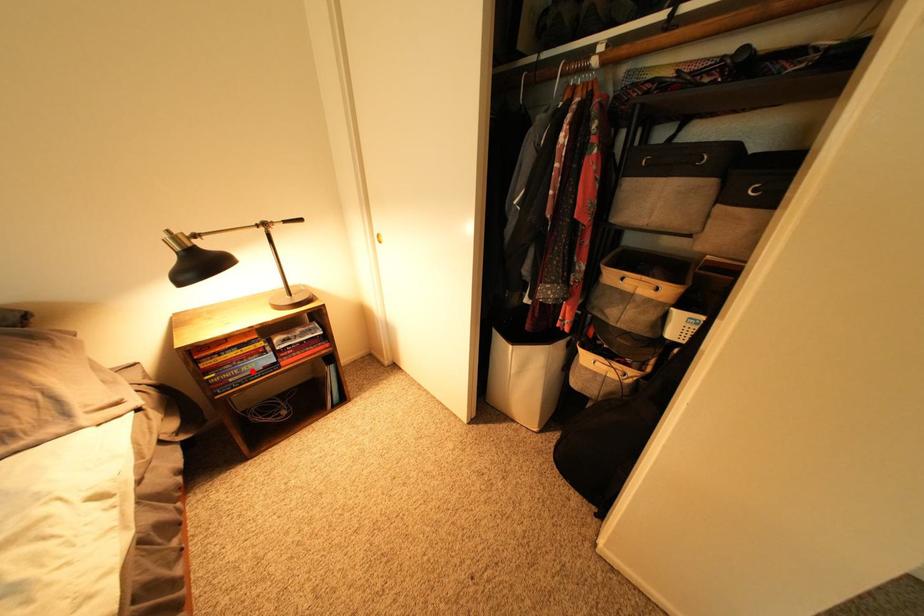
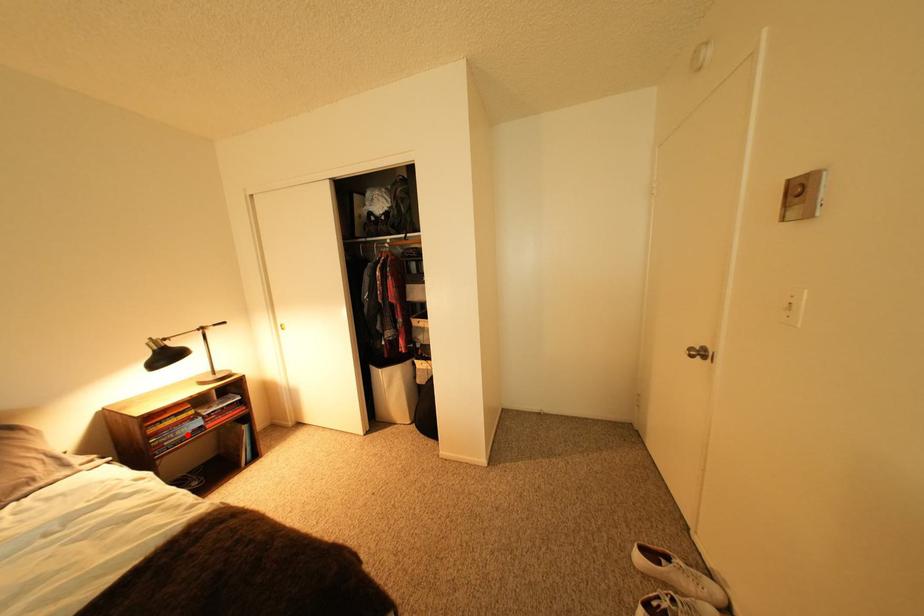
I am providing you with two images of the same scene from different viewpoints. A red point is marked on the first image and another point is marked on the second image. Is the red point in image1 aligned with the point shown in image2?

Yes